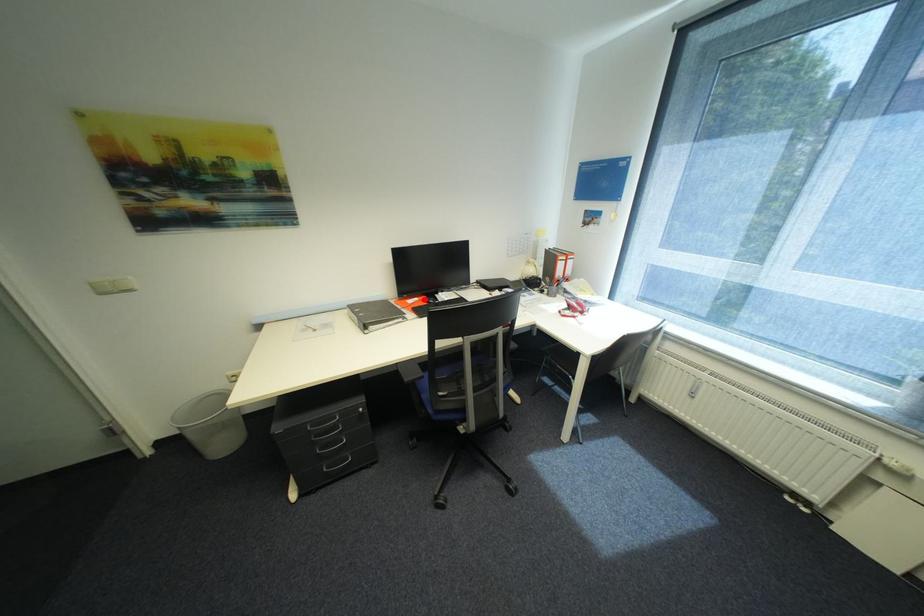
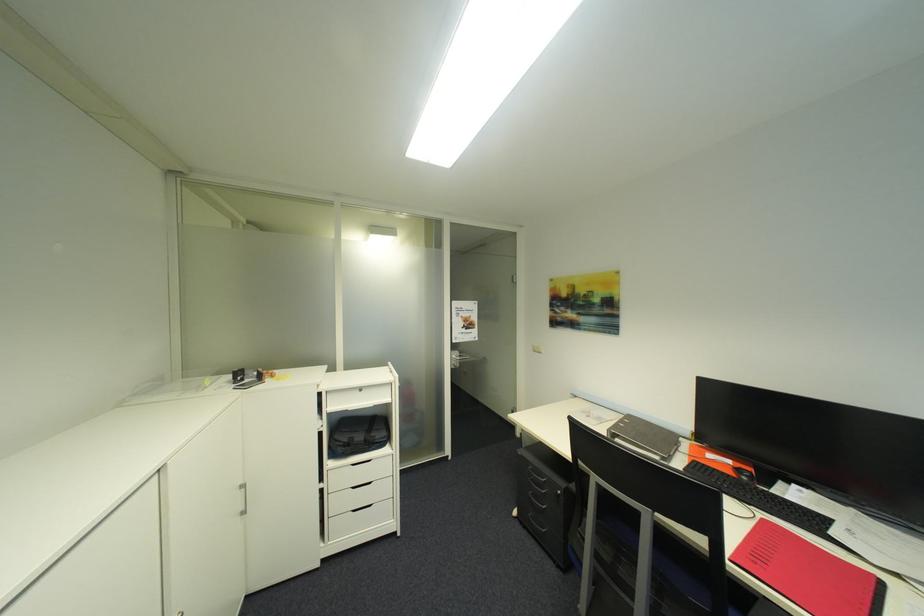
In the second image, find the point that corresponds to the highlighted location in the first image.

(736, 463)